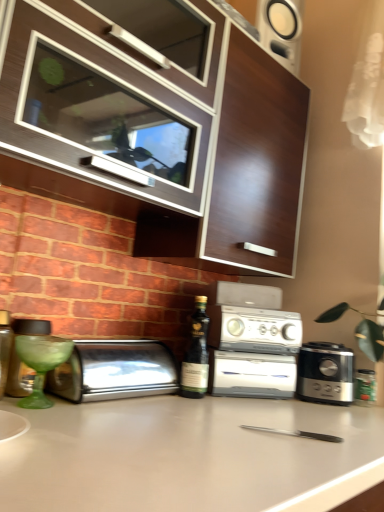
You are a GUI agent. You are given a task and a screenshot of the screen. Output one action in this format:
    pyautogui.click(x=<x>, y=<y>)
    Task: Click on the free area in between matte brown bottle at left, the first bottle positioned from the front, and green glass jar at right, which appears as the 1th bottle when viewed from the back
    This screenshot has width=384, height=512.
    Given the screenshot: What is the action you would take?
    tap(204, 400)